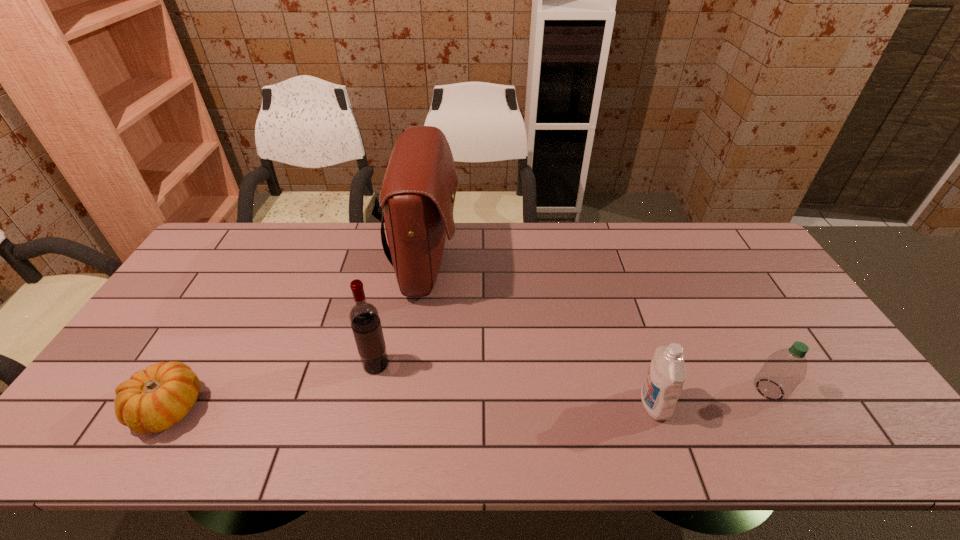
Image resolution: width=960 pixels, height=540 pixels. I want to click on free spot located on the right of the second tallest object, so click(500, 365).

Where is `vacant region located 0.250m on the left of the detergent`? This screenshot has width=960, height=540. vacant region located 0.250m on the left of the detergent is located at coordinates (537, 404).

Find the location of a particular element. vacant space located on the right of the rightmost object is located at coordinates (810, 389).

At what (x,y) coordinates should I click in order to perform the action: click on blank space located on the back of the shortest object. Please return your answer as a coordinate pair (x, y). Looking at the image, I should click on (226, 310).

Where is `object that is at the far edge`? This screenshot has width=960, height=540. object that is at the far edge is located at coordinates coord(417,197).

Find the location of a particular element. detergent that is at the near edge is located at coordinates (666, 375).

This screenshot has height=540, width=960. I want to click on gourd present at the near edge, so click(x=153, y=400).

I want to click on object that is at the left edge, so click(153, 400).

In order to click on object located at the near left corner in this screenshot , I will do `click(153, 400)`.

This screenshot has width=960, height=540. I want to click on free space at the far edge, so click(330, 241).